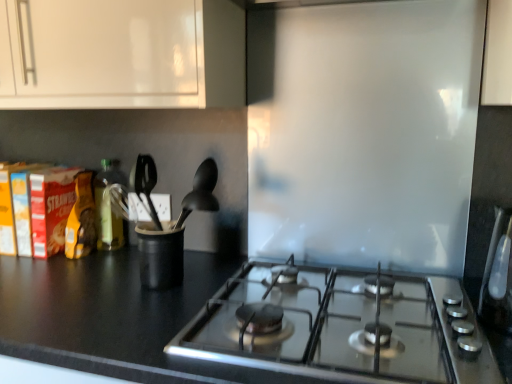
Identify the location of unoccupied area behind satin silver toaster at right. This screenshot has width=512, height=384. (448, 297).